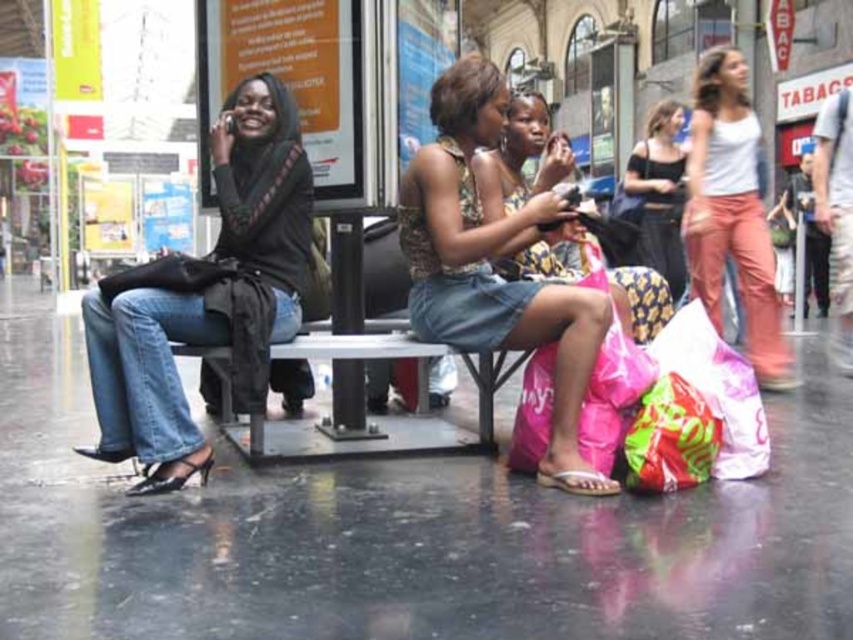
You are standing at the bus stop and want to take a photo of the two women on the metal bench. The first woman is at point (743, 83) and the second woman is at point (526, 150). Which woman will appear closer to the camera in your photo?

The woman at point (743, 83) will appear closer to the camera because point (743, 83) is further to the camera than point (526, 150).

Consider the image. You are a person trying to sit down on the metallic gray bench at center. There is a matte black tank top at upper right nearby. Can you sit on the bench without touching the tank top?

The metallic gray bench at center is wider than the matte black tank top at upper right, so you can sit on the bench without touching the tank top.